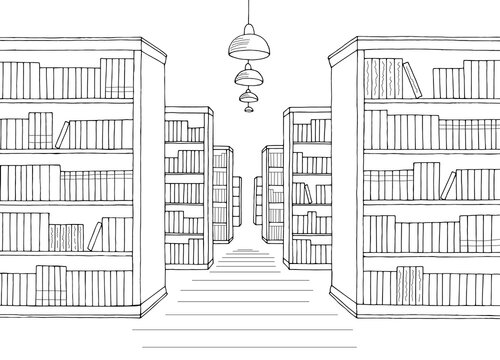
This screenshot has height=360, width=500. I want to click on hanging light shades, so click(x=250, y=42), click(x=250, y=75), click(x=245, y=94), click(x=248, y=109).